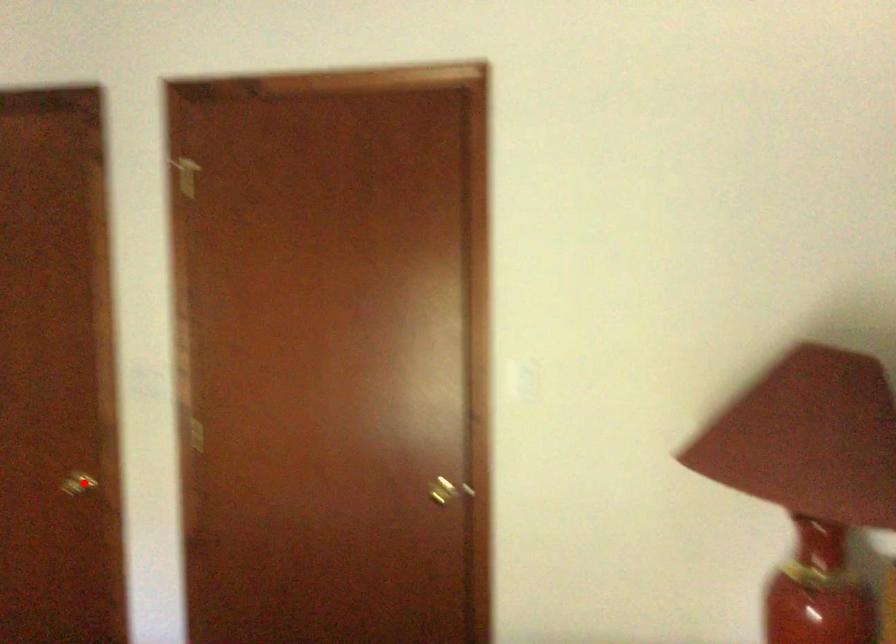
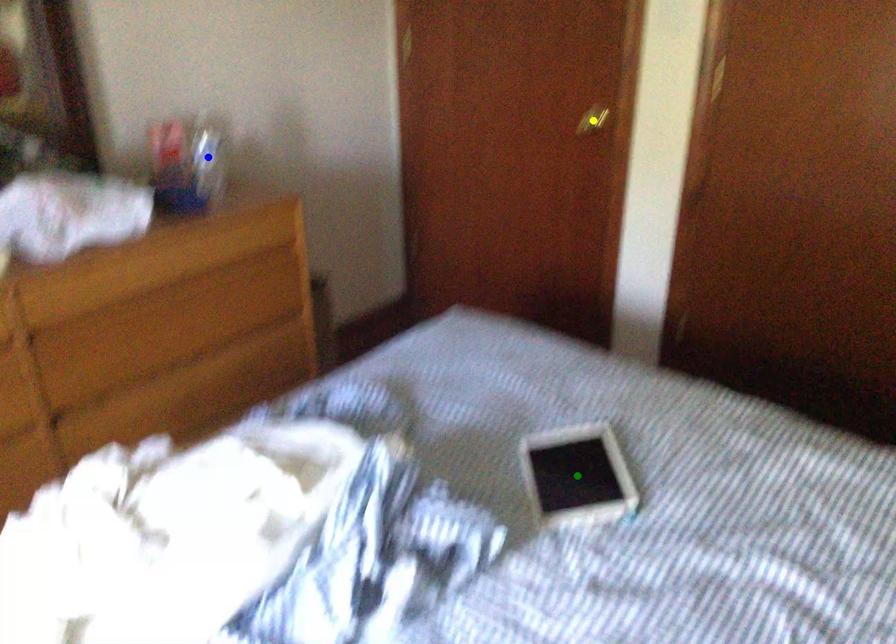
Question: I am providing you with two images of the same scene from different viewpoints. A red point is marked on the first image. You are given multiple points on the second image. Which point in image 2 represents the same 3d spot as the red point in image 1?

Choices:
 (A) blue point
 (B) yellow point
 (C) green point

Answer: (B)